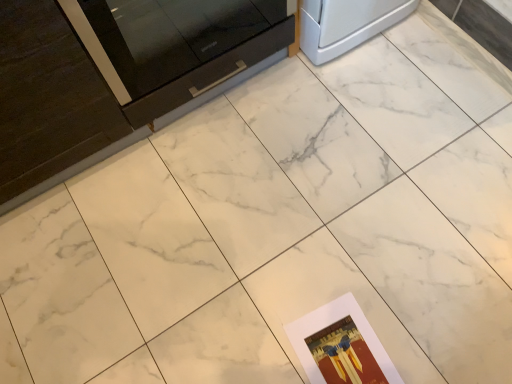
Question: Based on their sizes in the image, would you say matte paper postcard at lower right is bigger or smaller than glossy black drawer at upper left?

Choices:
 (A) small
 (B) big

Answer: (A)

Question: Is point (377, 380) closer or farther from the camera than point (228, 59)?

Choices:
 (A) farther
 (B) closer

Answer: (B)

Question: From the image's perspective, is matte paper postcard at lower right above or below glossy black drawer at upper left?

Choices:
 (A) below
 (B) above

Answer: (A)

Question: Looking at their shapes, would you say glossy black drawer at upper left is wider or thinner than matte paper postcard at lower right?

Choices:
 (A) thin
 (B) wide

Answer: (A)

Question: Considering the positions of glossy black drawer at upper left and matte paper postcard at lower right in the image, is glossy black drawer at upper left bigger or smaller than matte paper postcard at lower right?

Choices:
 (A) small
 (B) big

Answer: (B)

Question: From a real-world perspective, is glossy black drawer at upper left physically located above or below matte paper postcard at lower right?

Choices:
 (A) below
 (B) above

Answer: (B)

Question: Considering the positions of point (220, 74) and point (321, 347), is point (220, 74) closer or farther from the camera than point (321, 347)?

Choices:
 (A) closer
 (B) farther

Answer: (B)